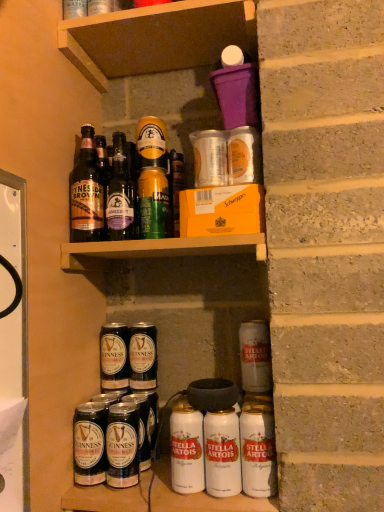
Question: Considering their positions, is dark brown glass bottle at lower left, the 2th beer in the front-to-back sequence, located in front of or behind metallic silver can at lower center, positioned as the 1th yoghurt in right-to-left order?

Choices:
 (A) front
 (B) behind

Answer: (B)

Question: Would you say dark brown glass bottle at lower left, which is the first beer from left to right, is inside or outside metallic silver can at lower center, positioned as the 1th yoghurt in right-to-left order?

Choices:
 (A) outside
 (B) inside

Answer: (A)

Question: Considering the real-world distances, which object is closest to the metallic silver can at lower center, acting as the 3th yoghurt starting from the left?

Choices:
 (A) brown wood shelf at upper center
 (B) matte glass bottle at upper center, which is the second bottle in left-to-right order
 (C) white matte can at lower center, positioned as the second yoghurt in right-to-left order
 (D) dark brown glass bottle at lower left, the 2th beer in the front-to-back sequence
 (E) green matte can at upper center, acting as the 1th yoghurt starting from the top

Answer: (C)

Question: Which object is the farthest from the dark brown glass bottles at center, the 1th beer positioned from the back?

Choices:
 (A) metallic silver can at lower center, which appears as the second yoghurt when ordered from the bottom
 (B) white matte can at lower right, which appears as the fourth beer when viewed from the left
 (C) brown wood shelf at upper center
 (D) matte glass bottle at upper center, which is the second bottle in left-to-right order
 (E) dark brown glass bottle at lower center

Answer: (C)